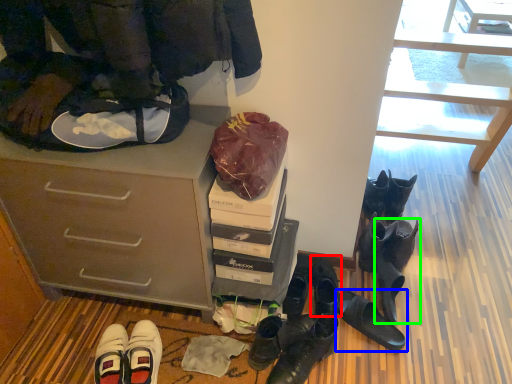
Question: Based on their relative distances, which object is nearer to footwear (highlighted by a red box)? Choose from footwear (highlighted by a blue box) and footwear (highlighted by a green box).

Choices:
 (A) footwear
 (B) footwear

Answer: (A)